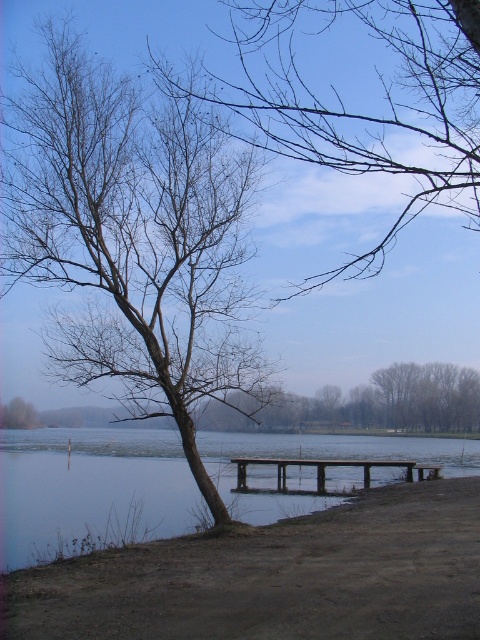
You are standing at the edge of the lake and notice a specific point marked at coordinates point (276, 577). What is located at that exact point?

The brown dirt at lower center is located at point (276, 577).